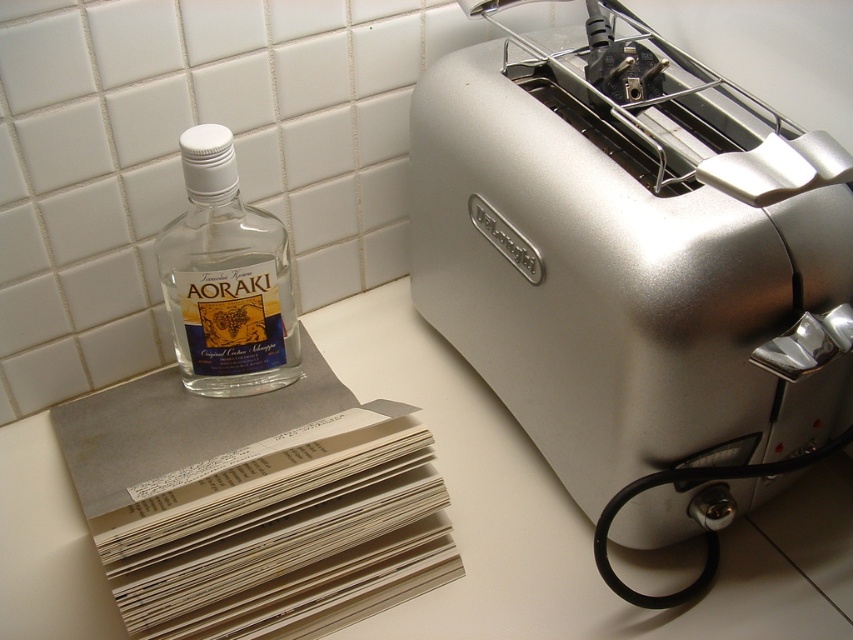
You are a chef preparing to place a new spice jar on the kitchen countertop. You need to know which object, the satin silver toaster at right or the transparent glass bottle at left, has a bigger footprint to determine where to place the spice jar. Which one should you consider?

The satin silver toaster at right is larger in size than the transparent glass bottle at left, so you should consider placing the spice jar near the transparent glass bottle at left since it has a smaller footprint.

You are a chef preparing to place a new spice jar between the satin silver toaster at right and the transparent glass bottle at left on the kitchen countertop. The spice jar is 3 inches wide. Is there enough space between the two objects to fit the spice jar?

The satin silver toaster at right is 11.22 inches away from the transparent glass bottle at left. Since the spice jar is 3 inches wide, there is sufficient space between them to fit the jar as 11.22 inches is greater than 3 inches.

You are standing in front of the kitchen countertop and want to place a new spice jar between the two points marked as point (641, 236) and point (189, 150). Which point should the spice jar be closer to if it needs to be placed in front of the other point?

The spice jar should be placed closer to point (641, 236) because it is in front of point (189, 150).